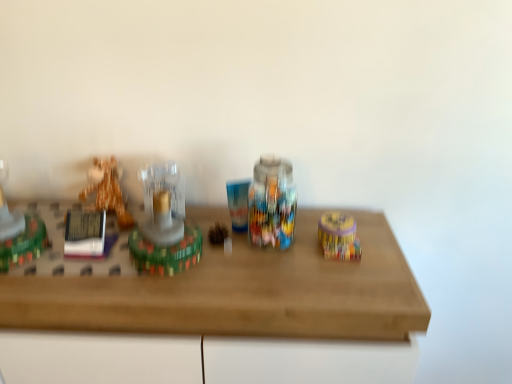
Locate an element on the screen. Image resolution: width=512 pixels, height=384 pixels. free space to the left of matte yellow container at right, which is counted as the first toy, starting from the right is located at coordinates (278, 249).